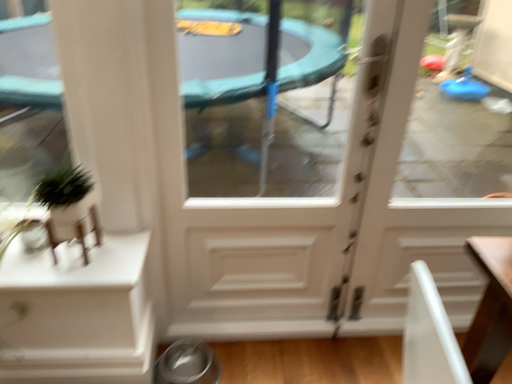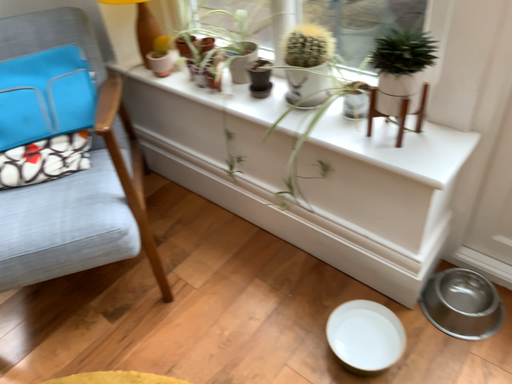
Question: Which way did the camera rotate in the video?

Choices:
 (A) rotated downward
 (B) rotated upward

Answer: (A)